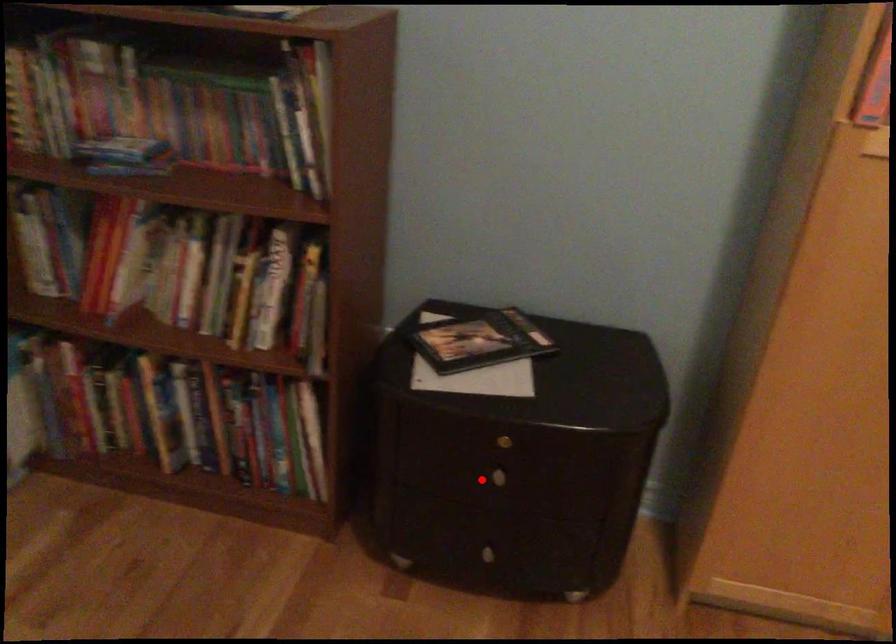
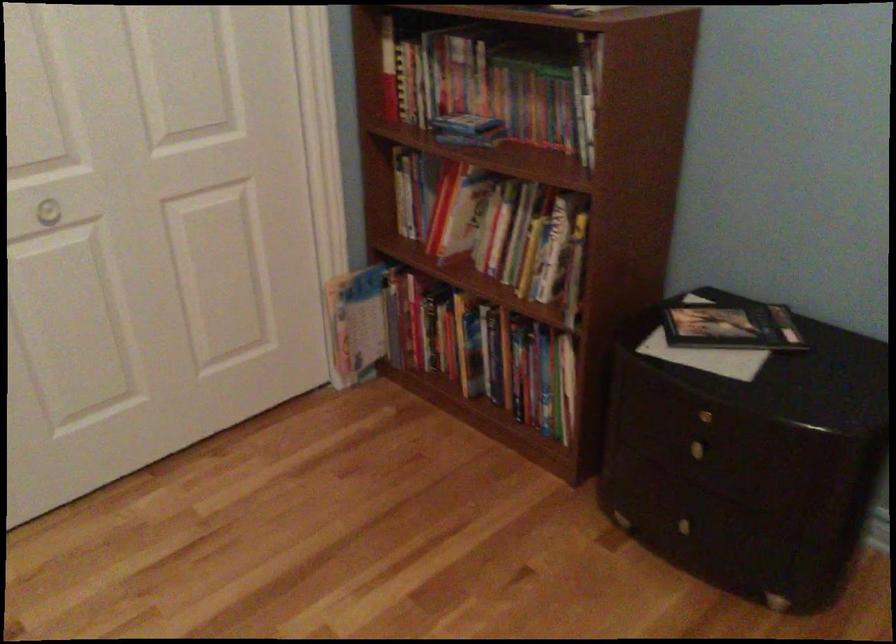
Where in the second image is the point corresponding to the highlighted location from the first image?

(686, 450)